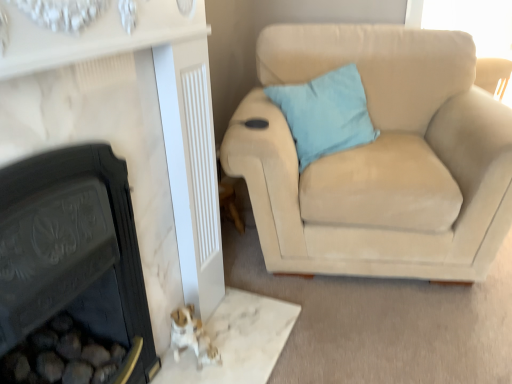
Question: Is light blue fabric pillow at upper right oriented away from suede beige couch at right?

Choices:
 (A) no
 (B) yes

Answer: (B)

Question: Considering the relative sizes of light blue fabric pillow at upper right and suede beige couch at right in the image provided, is light blue fabric pillow at upper right shorter than suede beige couch at right?

Choices:
 (A) yes
 (B) no

Answer: (A)

Question: Is light blue fabric pillow at upper right not close to suede beige couch at right?

Choices:
 (A) yes
 (B) no

Answer: (B)

Question: Would you say suede beige couch at right is part of light blue fabric pillow at upper right's contents?

Choices:
 (A) yes
 (B) no

Answer: (B)

Question: Considering the relative positions of light blue fabric pillow at upper right and suede beige couch at right in the image provided, is light blue fabric pillow at upper right to the left of suede beige couch at right from the viewer's perspective?

Choices:
 (A) no
 (B) yes

Answer: (B)

Question: From the image's perspective, is light blue fabric pillow at upper right beneath suede beige couch at right?

Choices:
 (A) no
 (B) yes

Answer: (A)

Question: Is light blue fabric pillow at upper right looking in the opposite direction of matte black fireplace at lower left, the second fireplace in the left-to-right sequence?

Choices:
 (A) no
 (B) yes

Answer: (A)

Question: From the image's perspective, would you say light blue fabric pillow at upper right is shown under matte black fireplace at lower left, positioned as the first fireplace in right-to-left order?

Choices:
 (A) no
 (B) yes

Answer: (A)

Question: Does light blue fabric pillow at upper right lie behind matte black fireplace at lower left, positioned as the first fireplace in right-to-left order?

Choices:
 (A) yes
 (B) no

Answer: (A)

Question: Considering the relative sizes of light blue fabric pillow at upper right and matte black fireplace at lower left, the second fireplace in the left-to-right sequence, in the image provided, is light blue fabric pillow at upper right thinner than matte black fireplace at lower left, the second fireplace in the left-to-right sequence,?

Choices:
 (A) no
 (B) yes

Answer: (A)

Question: Is light blue fabric pillow at upper right in contact with matte black fireplace at lower left, positioned as the first fireplace in right-to-left order?

Choices:
 (A) no
 (B) yes

Answer: (A)

Question: Does light blue fabric pillow at upper right have a larger size compared to matte black fireplace at lower left, the second fireplace in the left-to-right sequence?

Choices:
 (A) no
 (B) yes

Answer: (A)

Question: Is black cast iron fireplace at lower left, the second fireplace positioned from the right, at the back of matte black fireplace at lower left, positioned as the first fireplace in right-to-left order?

Choices:
 (A) no
 (B) yes

Answer: (B)